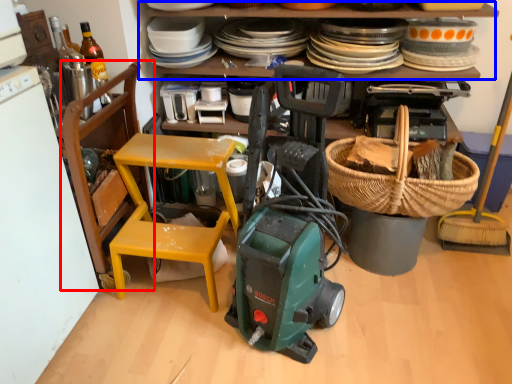
Question: Which object is further to the camera taking this photo, chair (highlighted by a red box) or shelf (highlighted by a blue box)?

Choices:
 (A) chair
 (B) shelf

Answer: (B)